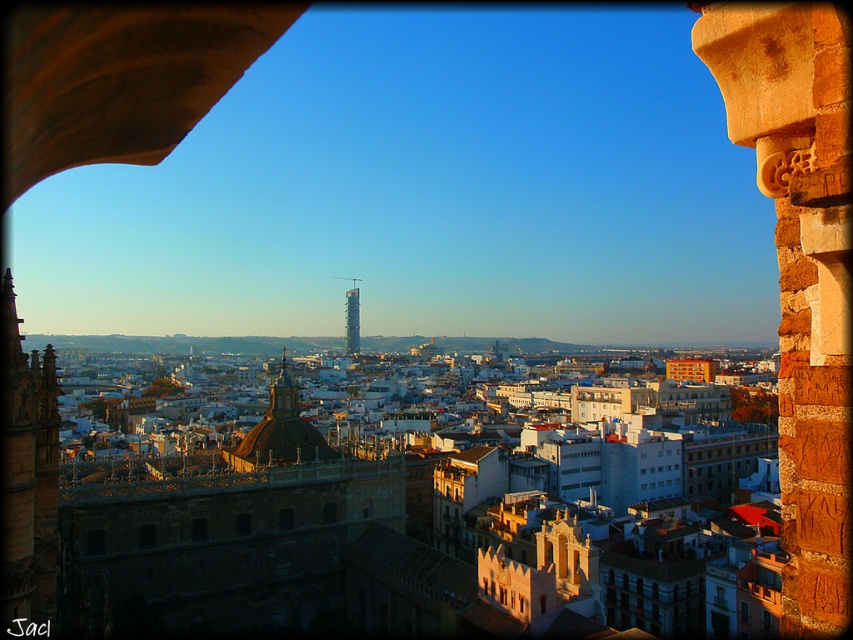
Question: Is the position of brown stone column at center right more distant than that of metallic glass tower at center?

Choices:
 (A) no
 (B) yes

Answer: (A)

Question: Which point is closer to the camera?

Choices:
 (A) metallic glass tower at center
 (B) brown stone column at center right

Answer: (B)

Question: Can you confirm if brown stone column at center right is positioned below metallic glass tower at center?

Choices:
 (A) yes
 (B) no

Answer: (A)

Question: Is brown stone column at center right bigger than metallic glass tower at center?

Choices:
 (A) no
 (B) yes

Answer: (B)